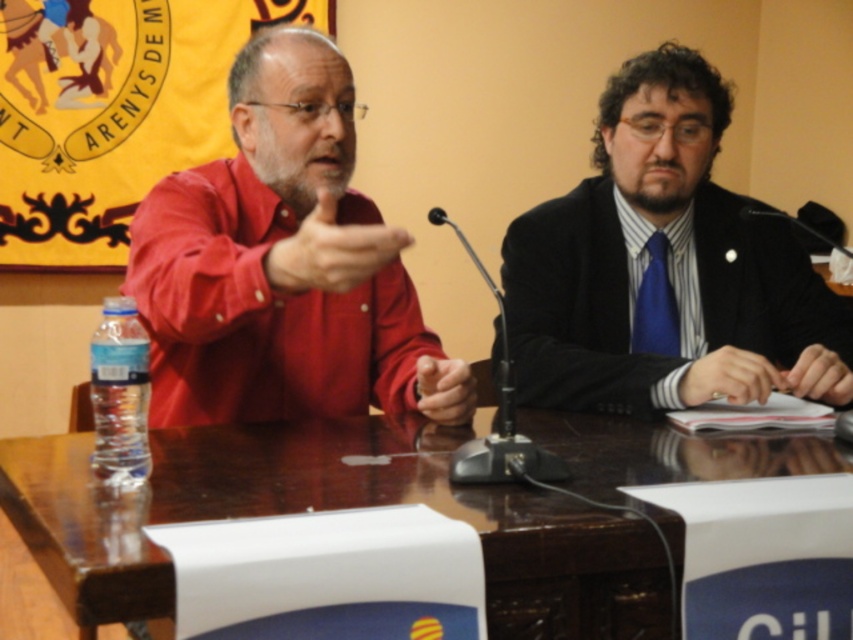
You are standing in front of the table where the two individuals are seated. You notice two points marked on the table. The first point is at coordinates point (548,381) and the second is at point (303,260). Which point is closer to you?

Point (548,381) is closer to you because it is further to the viewer than point (303,260).

You are a photographer standing at the camera position. You need to place a small decorative item on the brown wooden table at center so that it is exactly halfway between the camera and the table. Is this possible?

The brown wooden table at center is 34.67 inches away from the camera. To place an item exactly halfway, it would need to be placed at 17.335 inches from the camera towards the table. Since the table itself is the surface, the item can be placed on the table at that midpoint distance, so yes, it is possible.

You are a photographer at the event and need to adjust the lighting so that both the blue silk tie at right and the matte red shirt at center are equally illuminated. Based on their positions, which direction should you move the light source to ensure both are lit properly?

The blue silk tie at right is to the right of the matte red shirt at center. To equally illuminate both, move the light source to the left so that it can evenly light both objects from that direction.